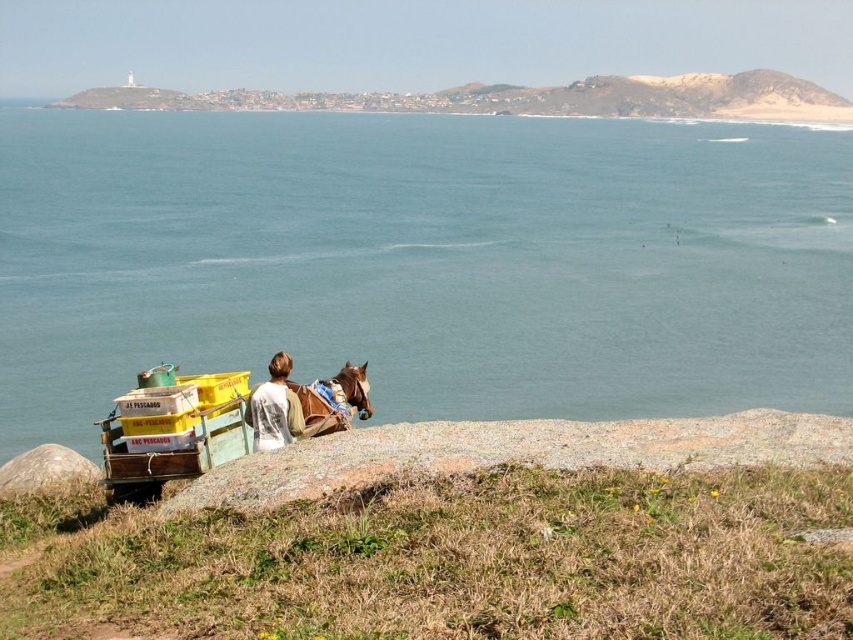
Question: Which point appears farthest from the camera in this image?

Choices:
 (A) (529, 92)
 (B) (415, 120)
 (C) (347, 420)
 (D) (184, 387)

Answer: (A)

Question: Among these points, which one is farthest from the camera?

Choices:
 (A) (283, 440)
 (B) (839, 132)

Answer: (B)

Question: Does yellow plastic wagon at lower left come behind brown glossy horse at center?

Choices:
 (A) yes
 (B) no

Answer: (B)

Question: Is blue water at center below brown glossy horse at center?

Choices:
 (A) yes
 (B) no

Answer: (B)

Question: Which point is farther to the camera?

Choices:
 (A) brown glossy horse at center
 (B) white cotton shirt at lower center

Answer: (A)

Question: Is yellow plastic wagon at lower left to the left of white cotton shirt at lower center from the viewer's perspective?

Choices:
 (A) no
 (B) yes

Answer: (B)